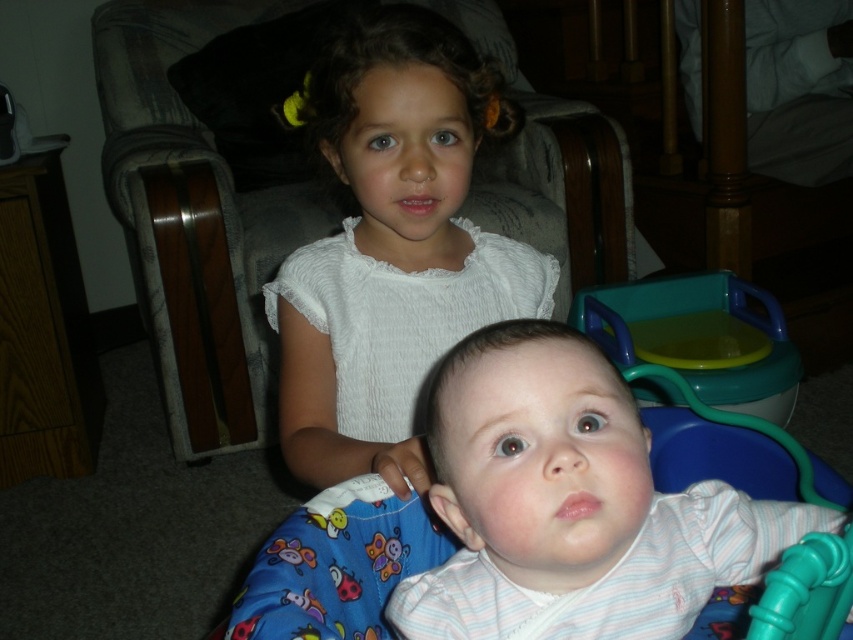
Question: Which object is farther from the camera taking this photo?

Choices:
 (A) teal plastic potty at lower right
 (B) white lace dress at upper center

Answer: (A)

Question: Can you confirm if white lace dress at upper center is bigger than teal plastic potty at lower right?

Choices:
 (A) no
 (B) yes

Answer: (B)

Question: Can you confirm if white striped shirt at center is positioned below white lace dress at upper center?

Choices:
 (A) no
 (B) yes

Answer: (B)

Question: Which object is closer to the camera taking this photo?

Choices:
 (A) white striped shirt at center
 (B) white lace dress at upper center
 (C) teal plastic potty at lower right

Answer: (A)

Question: Among these points, which one is farthest from the camera?

Choices:
 (A) (679, 529)
 (B) (772, 310)
 (C) (308, 404)

Answer: (B)

Question: Is white striped shirt at center wider than teal plastic potty at lower right?

Choices:
 (A) no
 (B) yes

Answer: (A)